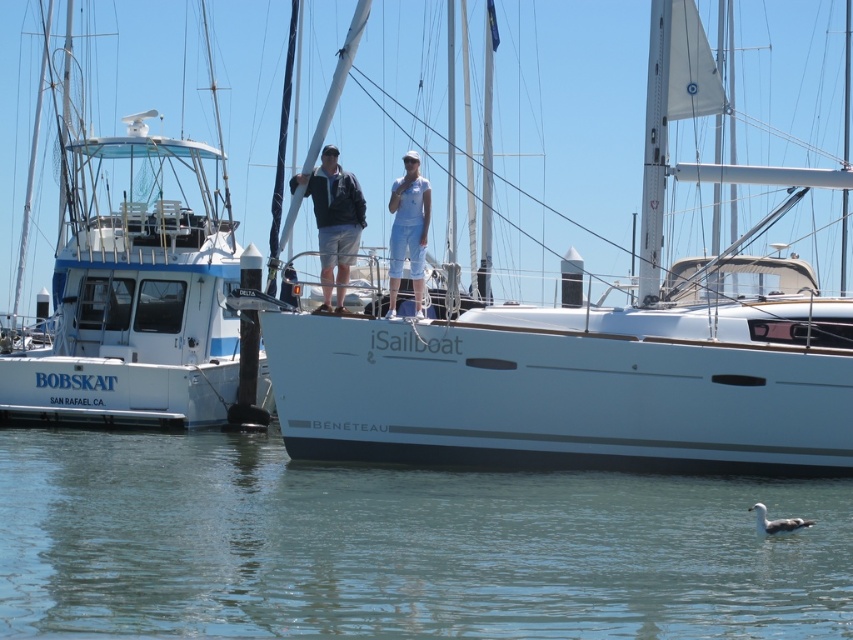
You are a photographer trying to capture a closeup of the light blue denim shorts at center and the white cotton shirt at center. Which one should you zoom in on to ensure they both fit in the frame?

The light blue denim shorts at center might be wider than the white cotton shirt at center, so you should zoom in on the light blue denim shorts at center to ensure both fit in the frame.

You are planning to take a photo of the white glossy sailboat at center and the clear blue water at lower center from the pier. Which object will occupy more horizontal space in your photo?

The clear blue water at lower center will occupy more horizontal space in the photo because its width surpasses that of the white glossy sailboat at center.

You are a tour guide at the marina and need to inform visitors about the distance between the white matte boat at left and the light blue denim shorts at center. How far apart are they?

The white matte boat at left and the light blue denim shorts at center are 52.67 feet apart.